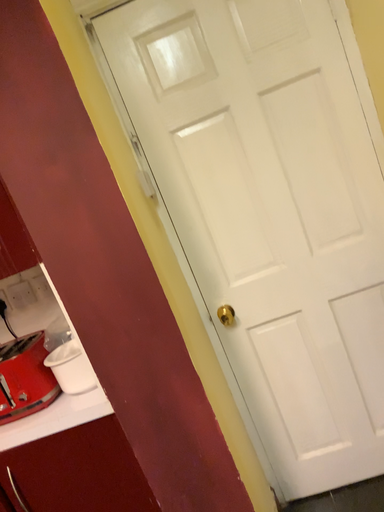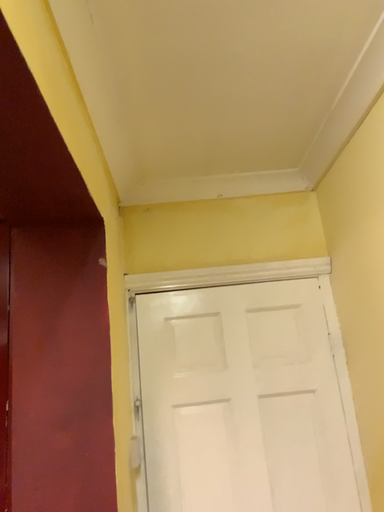
Question: How did the camera likely rotate when shooting the video?

Choices:
 (A) rotated left
 (B) rotated right

Answer: (B)